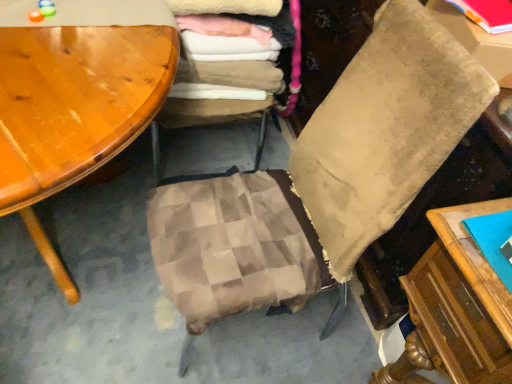
Question: Can you confirm if beige velvety pillow at center is taller than plaid fabric cushion at center?

Choices:
 (A) yes
 (B) no

Answer: (A)

Question: Considering the relative positions of beige velvety pillow at center and plaid fabric cushion at center in the image provided, is beige velvety pillow at center to the left of plaid fabric cushion at center from the viewer's perspective?

Choices:
 (A) no
 (B) yes

Answer: (A)

Question: From the image's perspective, is beige velvety pillow at center below plaid fabric cushion at center?

Choices:
 (A) no
 (B) yes

Answer: (A)

Question: From the image's perspective, is beige velvety pillow at center on plaid fabric cushion at center?

Choices:
 (A) no
 (B) yes

Answer: (B)

Question: Is beige velvety pillow at center oriented away from plaid fabric cushion at center?

Choices:
 (A) no
 (B) yes

Answer: (B)

Question: Choose the correct answer: Is soft cotton laundry at center inside matte red book at upper right or outside it?

Choices:
 (A) inside
 (B) outside

Answer: (B)

Question: From the image's perspective, is soft cotton laundry at center positioned above or below matte red book at upper right?

Choices:
 (A) below
 (B) above

Answer: (B)

Question: Considering the positions of point (291, 38) and point (484, 9), is point (291, 38) closer or farther from the camera than point (484, 9)?

Choices:
 (A) farther
 (B) closer

Answer: (A)

Question: Is soft cotton laundry at center in front of or behind matte red book at upper right in the image?

Choices:
 (A) front
 (B) behind

Answer: (B)

Question: Considering the positions of matte red book at upper right and beige velvety pillow at center in the image, is matte red book at upper right taller or shorter than beige velvety pillow at center?

Choices:
 (A) short
 (B) tall

Answer: (A)

Question: Which is correct: matte red book at upper right is inside beige velvety pillow at center, or outside of it?

Choices:
 (A) outside
 (B) inside

Answer: (A)

Question: Is matte red book at upper right in front of or behind beige velvety pillow at center in the image?

Choices:
 (A) behind
 (B) front

Answer: (A)

Question: From the image's perspective, relative to beige velvety pillow at center, is matte red book at upper right above or below?

Choices:
 (A) above
 (B) below

Answer: (B)

Question: Considering the positions of matte cardboard box at upper right and matte red book at upper right in the image, is matte cardboard box at upper right wider or thinner than matte red book at upper right?

Choices:
 (A) wide
 (B) thin

Answer: (A)

Question: From a real-world perspective, relative to matte red book at upper right, is matte cardboard box at upper right vertically above or below?

Choices:
 (A) below
 (B) above

Answer: (A)